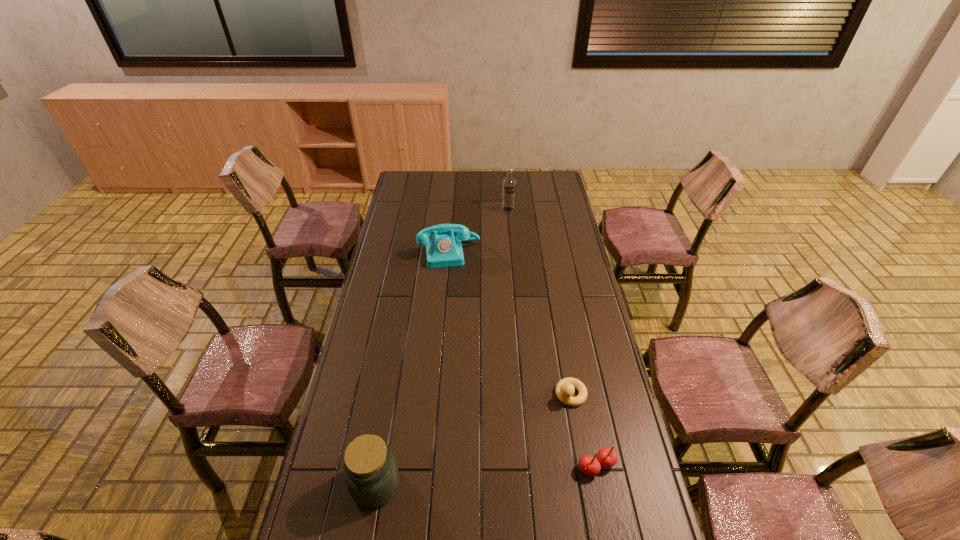
Identify the location of free space on the desktop that is between the jar and the cherry and is positioned on the dial of the telephone. (481, 476).

Find the location of `free spot on the desktop that is between the jar and the cherry and is positioned on the front label of the farthest object`. free spot on the desktop that is between the jar and the cherry and is positioned on the front label of the farthest object is located at coordinates (512, 473).

Where is `vacant space on the desktop that is between the jar and the cherry and is positioned at the beak of the third farthest object`? Image resolution: width=960 pixels, height=540 pixels. vacant space on the desktop that is between the jar and the cherry and is positioned at the beak of the third farthest object is located at coordinates click(x=499, y=474).